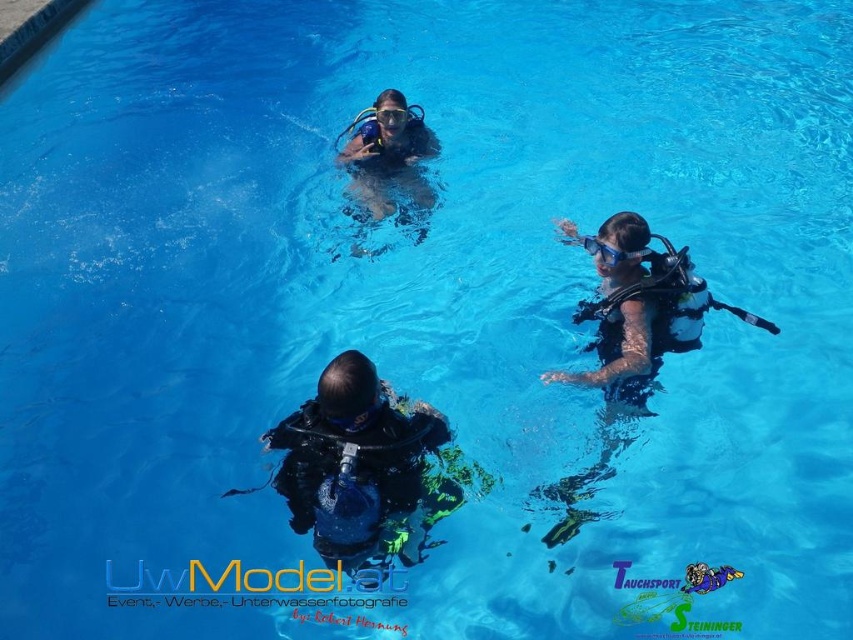
You are a safety officer at the pool and need to ensure the black matte scuba gear at center is within the 5 meter safety zone. Based on the description, is it within the safety zone?

The black matte scuba gear at center is 6.19 meters away from viewer, which exceeds the 5 meter safety zone. Therefore, it is outside the safety zone.

Based on the photo, you are a lifeguard observing the black matte scuba gear at center and the matte black scuba gear at upper center in the pool. Which one has a greater width?

The black matte scuba gear at center has a greater width than the matte black scuba gear at upper center.

You are a scuba instructor observing the divers in the pool. You notice the transparent rubber goggles at upper center and the matte black scuba gear at upper center. Which object is closer to the surface of the water?

The matte black scuba gear at upper center is closer to the surface of the water because the transparent rubber goggles at upper center is behind it.